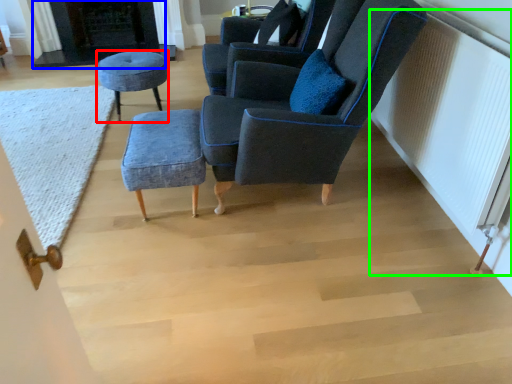
Question: Based on their relative distances, which object is nearer to stool (highlighted by a red box)? Choose from fireplace (highlighted by a blue box) and radiator (highlighted by a green box).

Choices:
 (A) fireplace
 (B) radiator

Answer: (A)